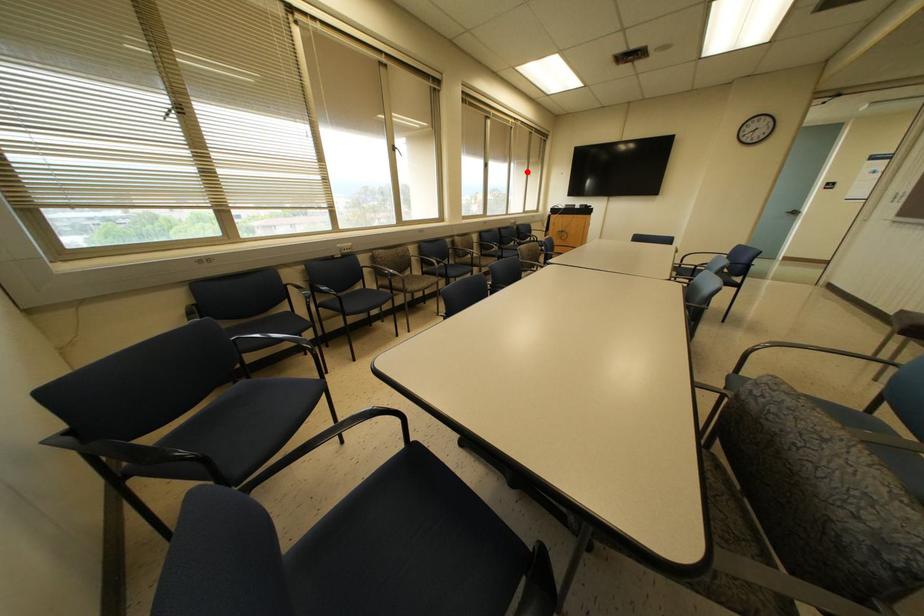
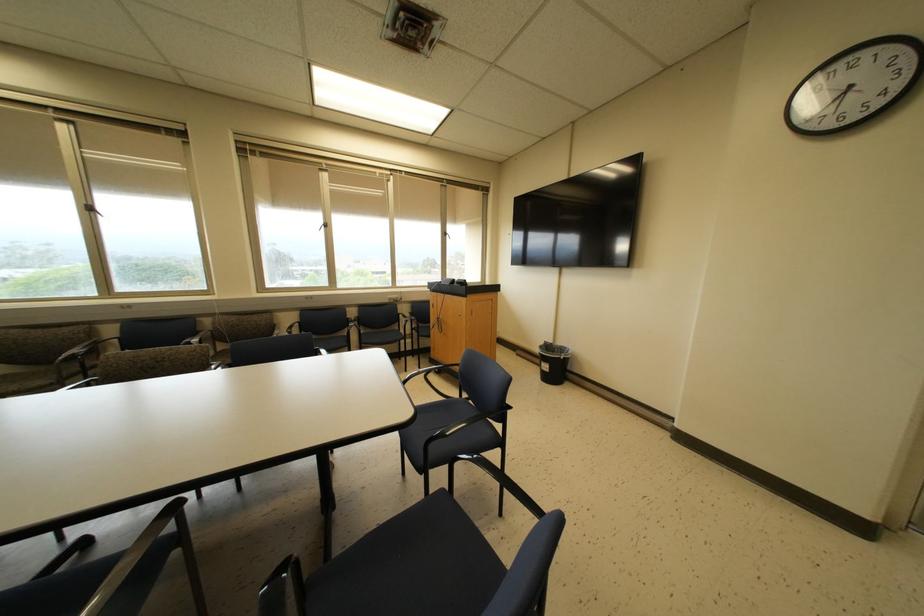
Question: I am providing you with two images of the same scene from different viewpoints. In image1, a red point is highlighted. Considering the same 3D point in image2, which of the following is correct?

Choices:
 (A) It is closer
 (B) It is farther

Answer: (B)